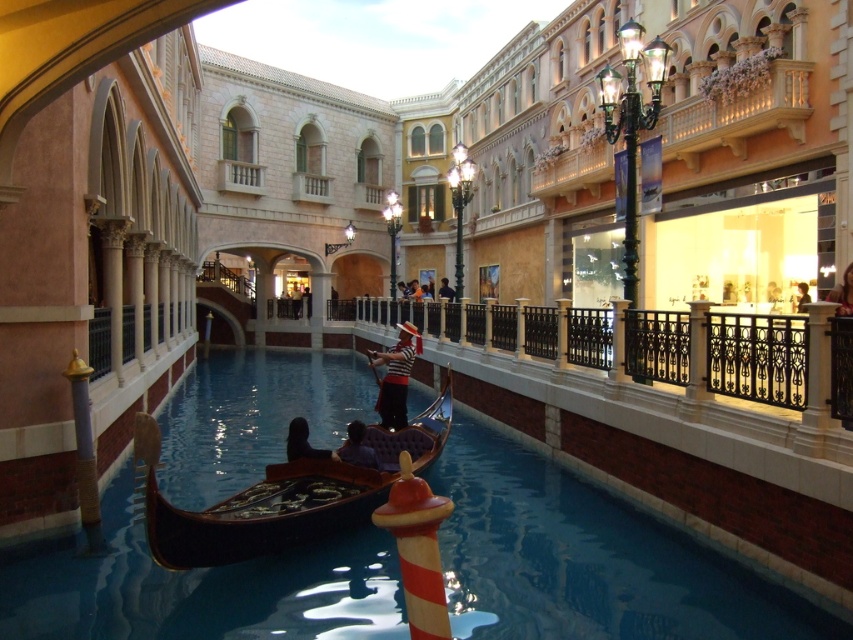
Question: Is smooth black gondola at center to the left of dark blue fabric shirt at center from the viewer's perspective?

Choices:
 (A) no
 (B) yes

Answer: (B)

Question: Based on their relative distances, which object is farther from the smooth black gondola at center?

Choices:
 (A) light brown leather jacket at upper right
 (B) striped fabric gondolier at center

Answer: (A)

Question: Where is black wrought iron railing at center located in relation to dark blue fabric shirt at center in the image?

Choices:
 (A) below
 (B) above

Answer: (A)

Question: From the image, what is the correct spatial relationship of dark polished wood gondola at center in relation to striped fabric gondolier at center?

Choices:
 (A) above
 (B) below

Answer: (B)

Question: Estimate the real-world distances between objects in this image. Which object is farther from the dark polished wood gondola at center?

Choices:
 (A) dark blue fabric shirt at center
 (B) black wrought iron railing at center
 (C) black polished water at center

Answer: (A)

Question: Which object is the closest to the smooth black gondola at center?

Choices:
 (A) striped fabric gondolier at center
 (B) dark polished wood gondola at center
 (C) dark fabric person at center
 (D) black wrought iron railing at center

Answer: (C)